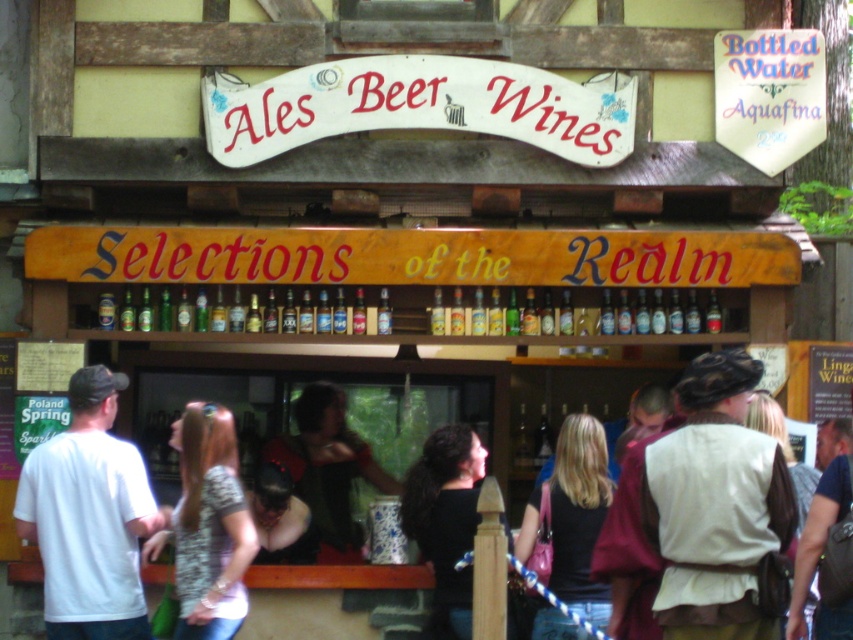
From the picture: You are a customer at the rustic outdoor bar. You want to order a drink but need to approach the counter. There is a patterned fabric shirt at lower left and a black leather jacket at lower center. How far apart are these two items?

The patterned fabric shirt at lower left and the black leather jacket at lower center are 1.47 meters apart.

You are a customer at the rustic outdoor bar and want to ask the bartender for a drink. The bartender is standing behind the counter. Which person should you approach first, the one wearing the patterned fabric shirt at lower left or the black leather jacket at lower center?

You should approach the patterned fabric shirt at lower left first because it is in front of the black leather jacket at lower center, meaning the person is closer to you.